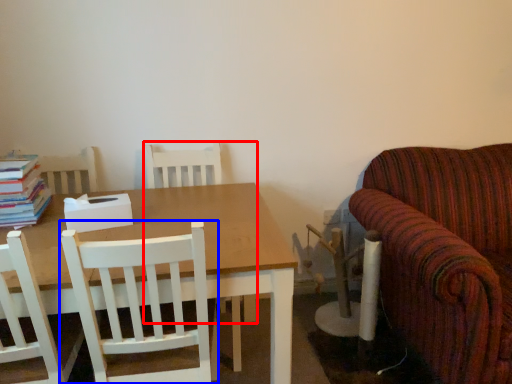
Question: Which object appears closest to the camera in this image, chair (highlighted by a red box) or chair (highlighted by a blue box)?

Choices:
 (A) chair
 (B) chair

Answer: (B)